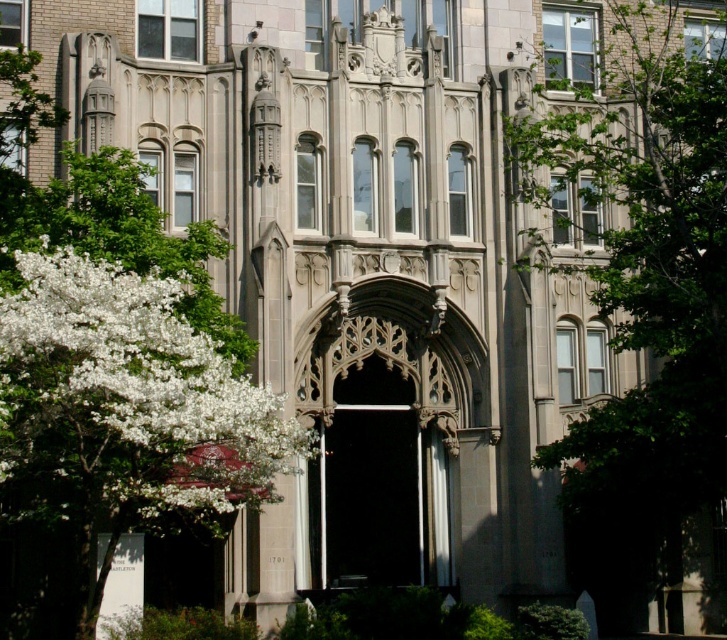
Question: Is green leafy tree at upper right positioned in front of white blossoms at left?

Choices:
 (A) no
 (B) yes

Answer: (A)

Question: Among these objects, which one is farthest from the camera?

Choices:
 (A) white blossoms at left
 (B) green leafy tree at upper right

Answer: (B)

Question: Is green leafy tree at upper right to the left of white blossoms at left from the viewer's perspective?

Choices:
 (A) yes
 (B) no

Answer: (B)

Question: Among these points, which one is nearest to the camera?

Choices:
 (A) pyautogui.click(x=699, y=394)
 (B) pyautogui.click(x=48, y=380)

Answer: (B)

Question: Among these objects, which one is nearest to the camera?

Choices:
 (A) green leafy tree at upper right
 (B) white blossoms at left

Answer: (B)

Question: In this image, where is green leafy tree at upper right located relative to white blossoms at left?

Choices:
 (A) right
 (B) left

Answer: (A)